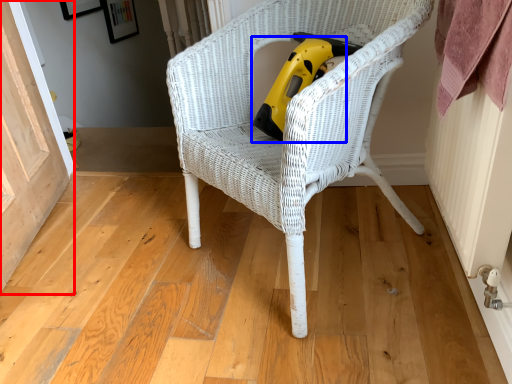
Question: Among these objects, which one is farthest to the camera, screen door (highlighted by a red box) or vacuum (highlighted by a blue box)?

Choices:
 (A) screen door
 (B) vacuum

Answer: (B)